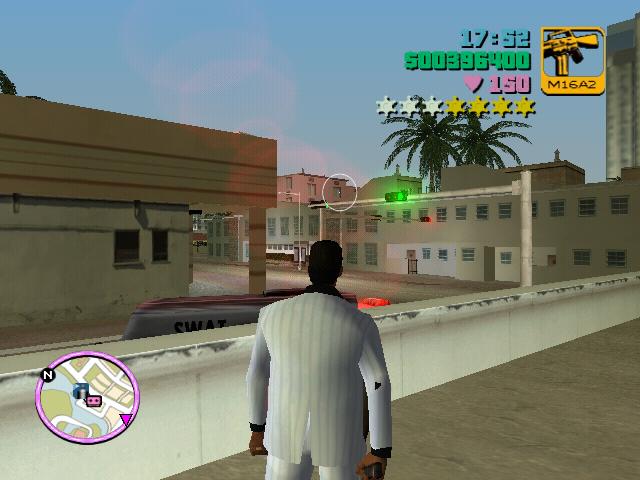
Locate an element on the screen. Image resolution: width=640 pixels, height=480 pixels. green light is located at coordinates pos(401,203).